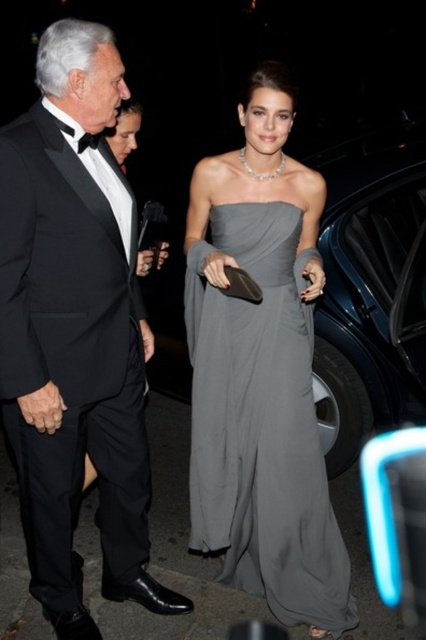
Based on the scene description, where is the black satin tuxedo at left located in the image?

The black satin tuxedo at left is located at the 2D coordinates point (74, 330) in the image.

You are a photographer standing 1.5 meters away from the black satin tuxedo at left. Can you take a clear photo of it without moving closer?

The black satin tuxedo at left is 1.73 meters away from the viewer. Since you are already 1.5 meters away, you can move slightly closer to take a clear photo.

You are a photographer at a gala event. You need to capture a photo where both the black satin tuxedo at left and the gray satin dress at center are visible. Based on their positions, which one should you focus on first to ensure both are in frame?

The black satin tuxedo at left is located above the gray satin dress at center, so you should focus on the black satin tuxedo at left first to ensure both are in frame.